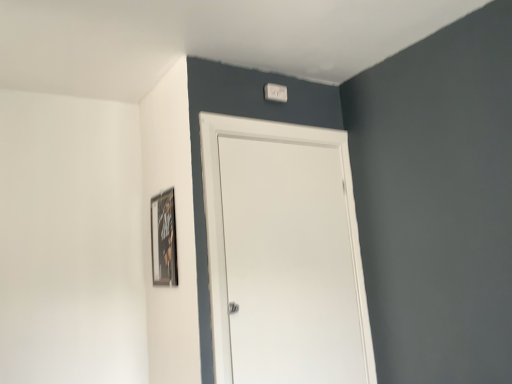
Identify the location of wooden framed poster at upper left. This screenshot has width=512, height=384. pos(164,239).

In order to click on white plastic light switch at upper center in this screenshot , I will do `click(275, 92)`.

From the image's perspective, is wooden framed poster at upper left on white plastic light switch at upper center?

Incorrect, from the image's perspective, wooden framed poster at upper left is lower than white plastic light switch at upper center.

Is wooden framed poster at upper left directly adjacent to white plastic light switch at upper center?

wooden framed poster at upper left and white plastic light switch at upper center are clearly separated.

How much distance is there between wooden framed poster at upper left and white plastic light switch at upper center?

A distance of 29.85 inches exists between wooden framed poster at upper left and white plastic light switch at upper center.

Is the position of wooden framed poster at upper left less distant than that of white plastic light switch at upper center?

Yes, it is.

Where is `door below the white plastic light switch at upper center (from a real-world perspective)`? The height and width of the screenshot is (384, 512). door below the white plastic light switch at upper center (from a real-world perspective) is located at coordinates (283, 254).

Considering the points (336, 138) and (281, 99), which point is in front, point (336, 138) or point (281, 99)?

The point (281, 99) is closer to the camera.

Can you confirm if white matte door at center is wider than white plastic light switch at upper center?

In fact, white matte door at center might be narrower than white plastic light switch at upper center.

Are white matte door at center and wooden framed poster at upper left making contact?

No, white matte door at center is not next to wooden framed poster at upper left.

In terms of width, does white matte door at center look wider or thinner when compared to wooden framed poster at upper left?

white matte door at center is wider than wooden framed poster at upper left.

Considering the positions of objects white matte door at center and wooden framed poster at upper left in the image provided, who is more to the left, white matte door at center or wooden framed poster at upper left?

wooden framed poster at upper left is more to the left.

From a real-world perspective, which object rests below the other?

In real-world perspective, white matte door at center is lower.

From the image's perspective, is wooden framed poster at upper left beneath white matte door at center?

No, from the image's perspective, wooden framed poster at upper left is not beneath white matte door at center.

Is wooden framed poster at upper left to the left or to the right of white matte door at center in the image?

Clearly, wooden framed poster at upper left is on the left of white matte door at center in the image.

Are wooden framed poster at upper left and white matte door at center located far from each other?

No.

Which object is more forward, wooden framed poster at upper left or white matte door at center?

white matte door at center is more forward.

The width and height of the screenshot is (512, 384). What are the coordinates of `light switch that appears behind the wooden framed poster at upper left` in the screenshot? It's located at (275, 92).

From the image's perspective, would you say white plastic light switch at upper center is positioned over wooden framed poster at upper left?

Indeed, from the image's perspective, white plastic light switch at upper center is shown above wooden framed poster at upper left.

How far apart are white plastic light switch at upper center and wooden framed poster at upper left?

29.85 inches.

Looking at this image, are white plastic light switch at upper center and wooden framed poster at upper left located far from each other?

→ No, white plastic light switch at upper center is not far away from wooden framed poster at upper left.

Is white plastic light switch at upper center turned away from white matte door at center?

No.

Which is in front, white plastic light switch at upper center or white matte door at center?

white matte door at center.

Which of these two, white plastic light switch at upper center or white matte door at center, is smaller?

With smaller size is white plastic light switch at upper center.

Identify the location of picture frame below the white plastic light switch at upper center (from the image's perspective). This screenshot has width=512, height=384. (164, 239).

Locate an element on the screen. The height and width of the screenshot is (384, 512). light switch that is on the left side of white matte door at center is located at coordinates click(x=275, y=92).

Looking at the image, which one is located further to wooden framed poster at upper left, white matte door at center or white plastic light switch at upper center?

white plastic light switch at upper center lies further to wooden framed poster at upper left than the other object.

When comparing their distances from white plastic light switch at upper center, does wooden framed poster at upper left or white matte door at center seem closer?

white matte door at center.

Which object lies further to the anchor point wooden framed poster at upper left, white plastic light switch at upper center or white matte door at center?

white plastic light switch at upper center.

From the image, which object appears to be farther from white plastic light switch at upper center, white matte door at center or wooden framed poster at upper left?

Among the two, wooden framed poster at upper left is located further to white plastic light switch at upper center.

When comparing their distances from white matte door at center, does wooden framed poster at upper left or white plastic light switch at upper center seem further?

white plastic light switch at upper center is positioned further to the anchor white matte door at center.

From the image, which object appears to be nearer to white matte door at center, white plastic light switch at upper center or wooden framed poster at upper left?

wooden framed poster at upper left lies closer to white matte door at center than the other object.

The image size is (512, 384). Find the location of `picture frame between white plastic light switch at upper center and white matte door at center vertically`. picture frame between white plastic light switch at upper center and white matte door at center vertically is located at coordinates (164, 239).